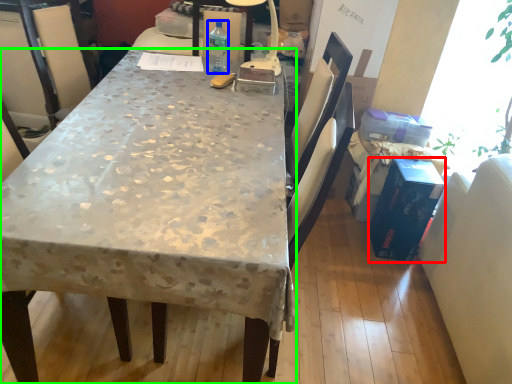
Question: Which is farther away from box (highlighted by a red box)? bottle (highlighted by a blue box) or desk (highlighted by a green box)?

Choices:
 (A) bottle
 (B) desk

Answer: (A)